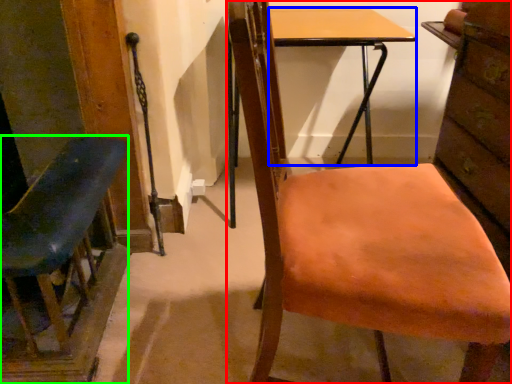
Question: Based on their relative distances, which object is nearer to chair (highlighted by a red box)? Choose from desk (highlighted by a blue box) and chair (highlighted by a green box).

Choices:
 (A) desk
 (B) chair

Answer: (B)